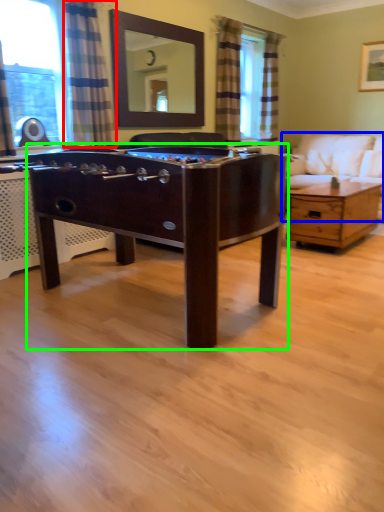
Question: Which object is positioned closest to curtain (highlighted by a red box)? Select from studio couch (highlighted by a blue box) and desk (highlighted by a green box).

Choices:
 (A) studio couch
 (B) desk

Answer: (B)